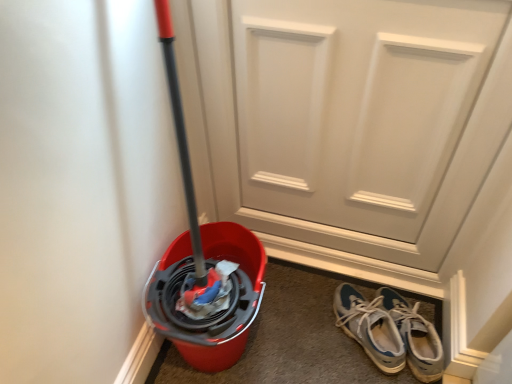
The image size is (512, 384). I want to click on white matte door at center, so click(x=369, y=120).

In order to face white matte door at center, should I rotate leftwards or rightwards?

You should rotate right by 10.472 degrees.

Describe the element at coordinates (369, 120) in the screenshot. I see `white matte door at center` at that location.

What is the approximate width of white matte door at center?

The width of white matte door at center is 4.05 inches.

The height and width of the screenshot is (384, 512). Describe the element at coordinates (390, 332) in the screenshot. I see `blue suede sneakers at lower right` at that location.

At what (x,y) coordinates should I click in order to perform the action: click on blue suede sneakers at lower right. Please return your answer as a coordinate pair (x, y). Image resolution: width=512 pixels, height=384 pixels. Looking at the image, I should click on (390, 332).

You are a GUI agent. You are given a task and a screenshot of the screen. Output one action in this format:
    pyautogui.click(x=<x>, y=<y>)
    Task: Click on the white matte door at center
    Image resolution: width=512 pixels, height=384 pixels.
    Given the screenshot: What is the action you would take?
    pyautogui.click(x=369, y=120)

Based on their positions, is blue suede sneakers at lower right located to the left or right of white matte door at center?

From the image, it's evident that blue suede sneakers at lower right is to the right of white matte door at center.

Which is in front, blue suede sneakers at lower right or white matte door at center?

white matte door at center.

Considering the positions of point (420, 316) and point (321, 244), is point (420, 316) closer or farther from the camera than point (321, 244)?

Point (420, 316) is positioned closer to the camera compared to point (321, 244).

From the image's perspective, which one is positioned lower, blue suede sneakers at lower right or white matte door at center?

blue suede sneakers at lower right is shown below in the image.

From a real-world perspective, is blue suede sneakers at lower right located higher than white matte door at center?

No, from a real-world perspective, blue suede sneakers at lower right is not above white matte door at center.

Is blue suede sneakers at lower right thinner than white matte door at center?

No.

Considering the sizes of objects blue suede sneakers at lower right and white matte door at center in the image provided, who is shorter, blue suede sneakers at lower right or white matte door at center?

blue suede sneakers at lower right is shorter.

Based on their sizes in the image, would you say blue suede sneakers at lower right is bigger or smaller than white matte door at center?

Considering their sizes, blue suede sneakers at lower right takes up less space than white matte door at center.

Would you say blue suede sneakers at lower right is inside or outside white matte door at center?

blue suede sneakers at lower right is not enclosed by white matte door at center.

Is blue suede sneakers at lower right touching white matte door at center?

No, blue suede sneakers at lower right is not touching white matte door at center.

Is blue suede sneakers at lower right oriented towards white matte door at center?

No, blue suede sneakers at lower right is not facing towards white matte door at center.

What's the angular difference between blue suede sneakers at lower right and white matte door at center's facing directions?

blue suede sneakers at lower right and white matte door at center are facing 39.5 degrees away from each other.

I want to click on footwear located below the white matte door at center (from the image's perspective), so click(390, 332).

Would you say white matte door at center is to the left or to the right of blue suede sneakers at lower right in the picture?

white matte door at center is to the left of blue suede sneakers at lower right.

Which object is closer to the camera taking this photo, white matte door at center or blue suede sneakers at lower right?

white matte door at center is closer to the camera.

Does point (404, 20) lie behind point (392, 336)?

No, (404, 20) is in front of (392, 336).

From the image's perspective, is white matte door at center on top of blue suede sneakers at lower right?

Yes.

From a real-world perspective, between white matte door at center and blue suede sneakers at lower right, who is vertically higher?

white matte door at center is physically above.

Considering the sizes of white matte door at center and blue suede sneakers at lower right in the image, is white matte door at center wider or thinner than blue suede sneakers at lower right?

Clearly, white matte door at center has less width compared to blue suede sneakers at lower right.

Does white matte door at center have a lesser height compared to blue suede sneakers at lower right?

Incorrect, the height of white matte door at center does not fall short of that of blue suede sneakers at lower right.

Between white matte door at center and blue suede sneakers at lower right, which one has smaller size?

blue suede sneakers at lower right is smaller.

Is white matte door at center not within blue suede sneakers at lower right?

Yes.

Is white matte door at center far from blue suede sneakers at lower right?

That's not correct — white matte door at center is a little close to blue suede sneakers at lower right.

Is white matte door at center looking in the opposite direction of blue suede sneakers at lower right?

No, white matte door at center is not facing the opposite direction of blue suede sneakers at lower right.

Measure the distance from white matte door at center to blue suede sneakers at lower right.

The distance of white matte door at center from blue suede sneakers at lower right is 15.85 inches.

This screenshot has width=512, height=384. What are the coordinates of `door above the blue suede sneakers at lower right (from a real-world perspective)` in the screenshot? It's located at [369, 120].

Locate an element on the screen. footwear that is on the right side of white matte door at center is located at coordinates (390, 332).

Find the location of a particular element. Image resolution: width=512 pixels, height=384 pixels. footwear below the white matte door at center (from the image's perspective) is located at coordinates (390, 332).